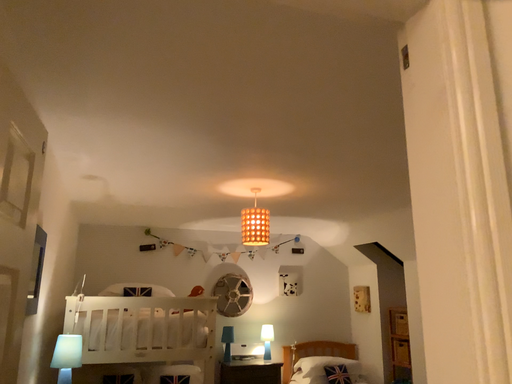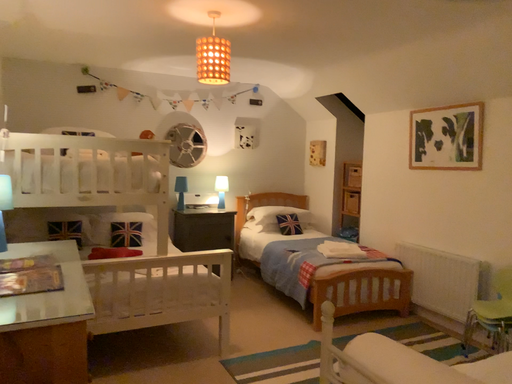
Question: Which way did the camera rotate in the video?

Choices:
 (A) rotated upward
 (B) rotated downward

Answer: (B)